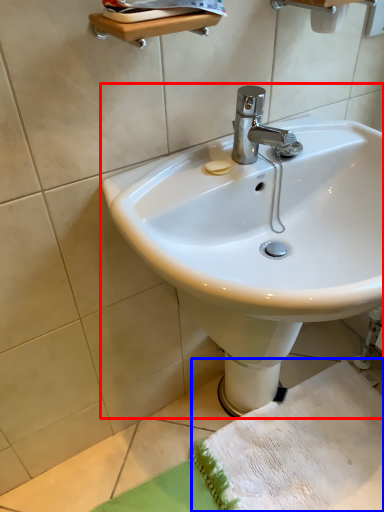
Question: Which object is further to the camera taking this photo, sink (highlighted by a red box) or beach towel (highlighted by a blue box)?

Choices:
 (A) sink
 (B) beach towel

Answer: (B)